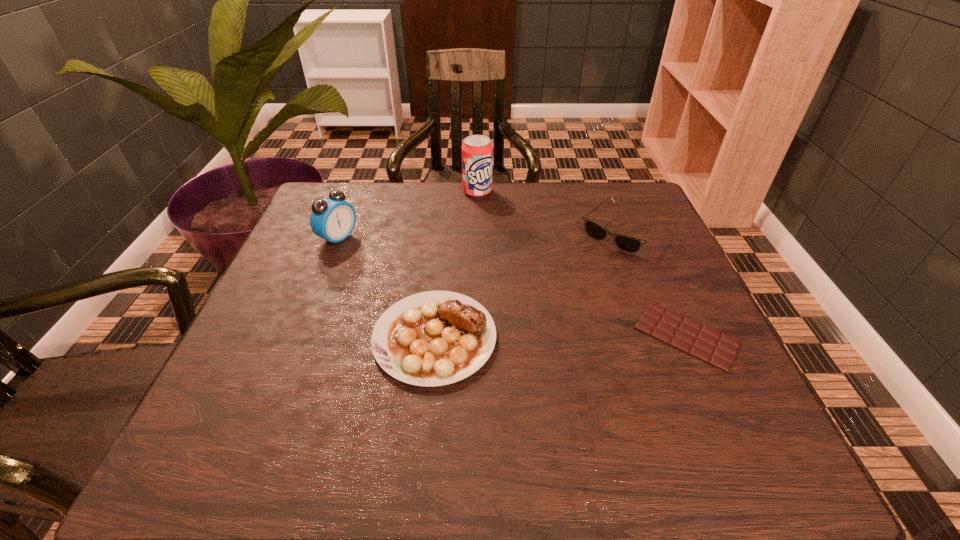
Where is `empty location between the steak and the fourth shortest object`? Image resolution: width=960 pixels, height=540 pixels. empty location between the steak and the fourth shortest object is located at coordinates (387, 288).

Where is `empty space that is in between the sunglasses and the shortest object`? This screenshot has height=540, width=960. empty space that is in between the sunglasses and the shortest object is located at coordinates (654, 283).

Find the location of a particular element. This screenshot has height=540, width=960. free spot between the sunglasses and the steak is located at coordinates (528, 284).

The width and height of the screenshot is (960, 540). Find the location of `free space between the chocolate bar and the farthest object`. free space between the chocolate bar and the farthest object is located at coordinates (582, 264).

Locate an element on the screen. The image size is (960, 540). free area in between the tallest object and the sunglasses is located at coordinates (550, 211).

Identify which object is the fourth closest to the chocolate bar. Please provide its 2D coordinates. Your answer should be formatted as a tuple, i.e. [(x, y)], where the tuple contains the x and y coordinates of a point satisfying the conditions above.

[(333, 219)]

Choose which object is the second nearest neighbor to the sunglasses. Please provide its 2D coordinates. Your answer should be formatted as a tuple, i.e. [(x, y)], where the tuple contains the x and y coordinates of a point satisfying the conditions above.

[(477, 152)]

Image resolution: width=960 pixels, height=540 pixels. I want to click on free space that satisfies the following two spatial constraints: 1. on the front side of the sunglasses; 2. on the right side of the farthest object, so click(477, 230).

Where is `vacant space that satisfies the following two spatial constraints: 1. on the back side of the sunglasses; 2. on the left side of the steak`? This screenshot has width=960, height=540. vacant space that satisfies the following two spatial constraints: 1. on the back side of the sunglasses; 2. on the left side of the steak is located at coordinates (445, 230).

You are a GUI agent. You are given a task and a screenshot of the screen. Output one action in this format:
    pyautogui.click(x=<x>, y=<y>)
    Task: Click on the vacant area in the image that satisfies the following two spatial constraints: 1. on the back side of the steak; 2. on the left side of the shortest object
    
    Given the screenshot: What is the action you would take?
    pyautogui.click(x=435, y=335)